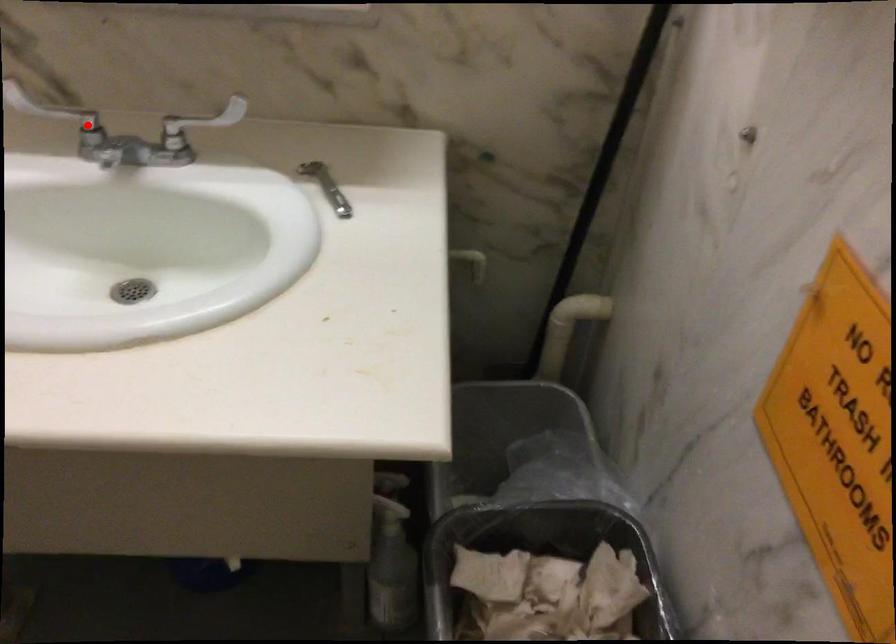
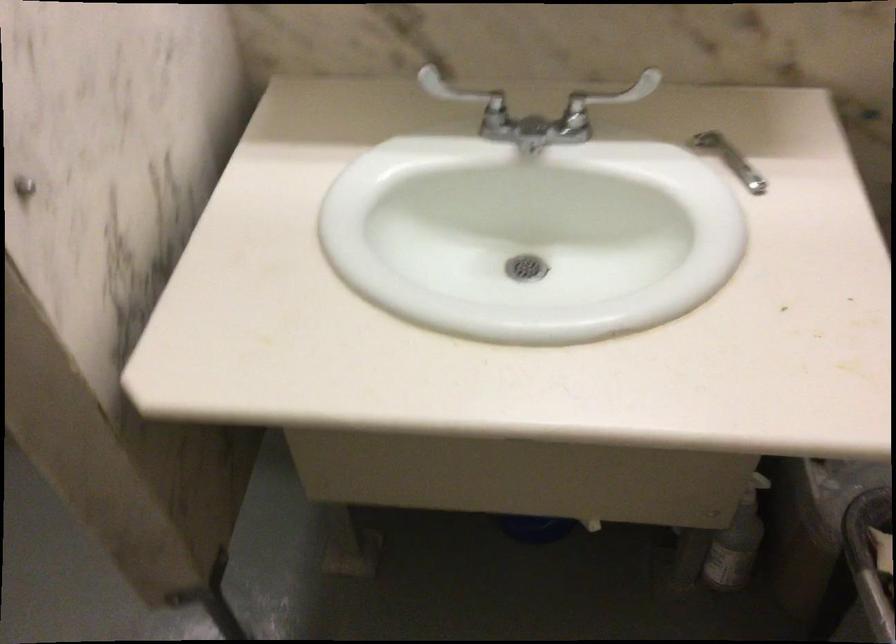
In the second image, find the point that corresponds to the highlighted location in the first image.

(464, 96)